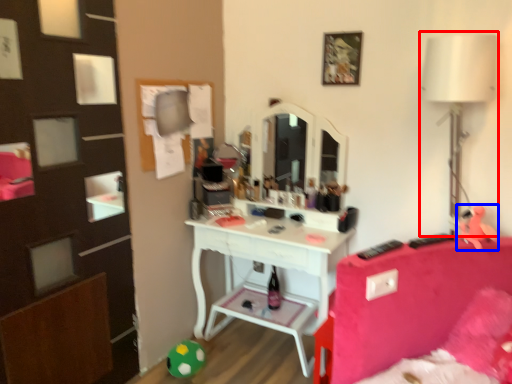
Question: Which of the following is the closest to the observer, table lamp (highlighted by a red box) or toy (highlighted by a blue box)?

Choices:
 (A) table lamp
 (B) toy

Answer: (A)